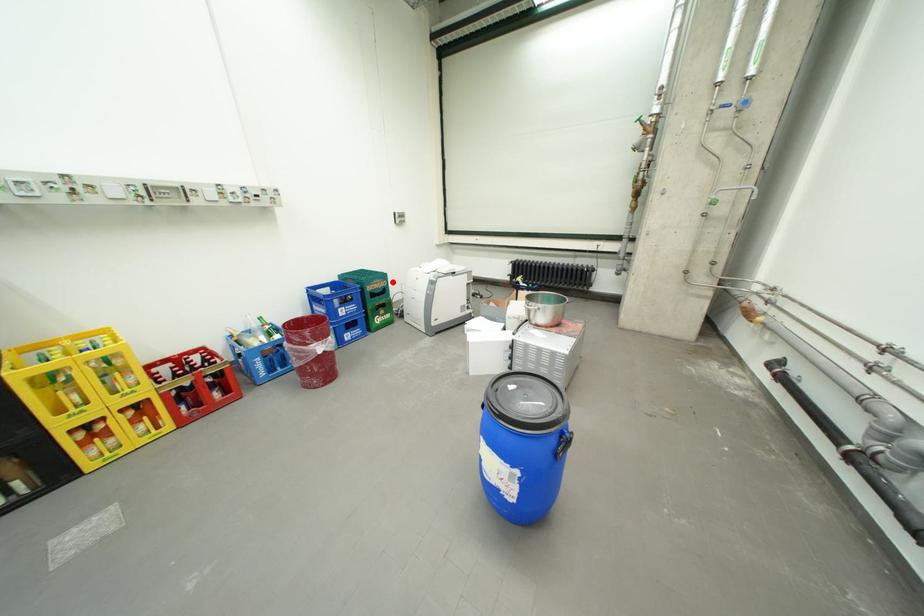
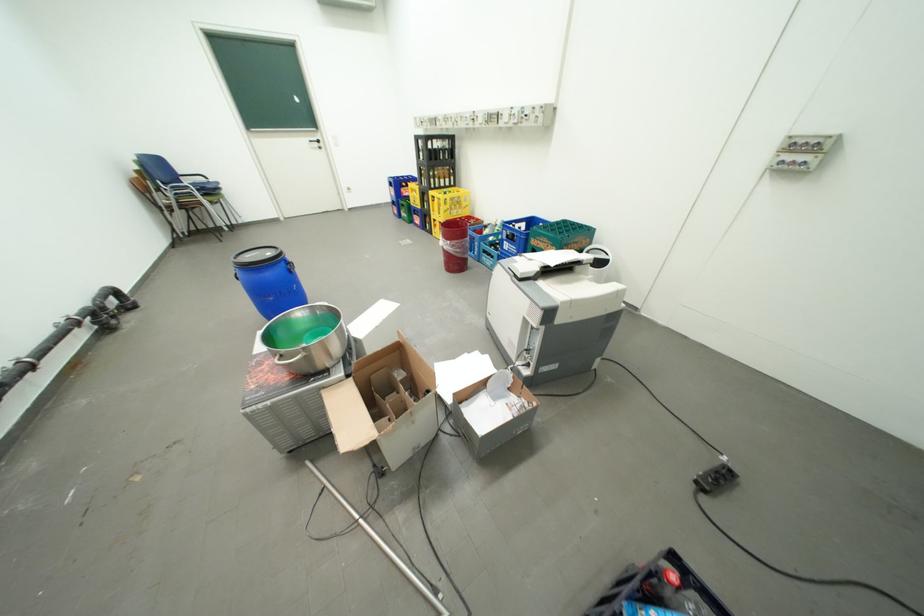
Question: I am providing you with two images of the same scene from different viewpoints. A red point is shown in image1. For the corresponding object point in image2, is it positioned nearer or farther from the camera?

Choices:
 (A) Nearer
 (B) Farther

Answer: (B)